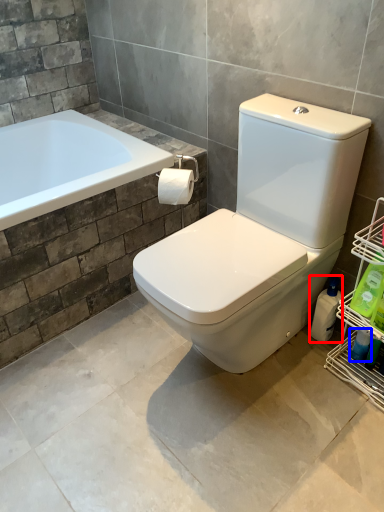
Question: Which point is further to the camera, cleaning product (highlighted by a red box) or cleaning product (highlighted by a blue box)?

Choices:
 (A) cleaning product
 (B) cleaning product

Answer: (A)